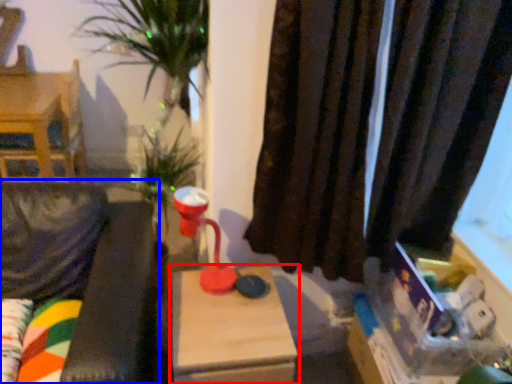
Question: Among these objects, which one is nearest to the camera, table (highlighted by a red box) or couch (highlighted by a blue box)?

Choices:
 (A) table
 (B) couch

Answer: (B)